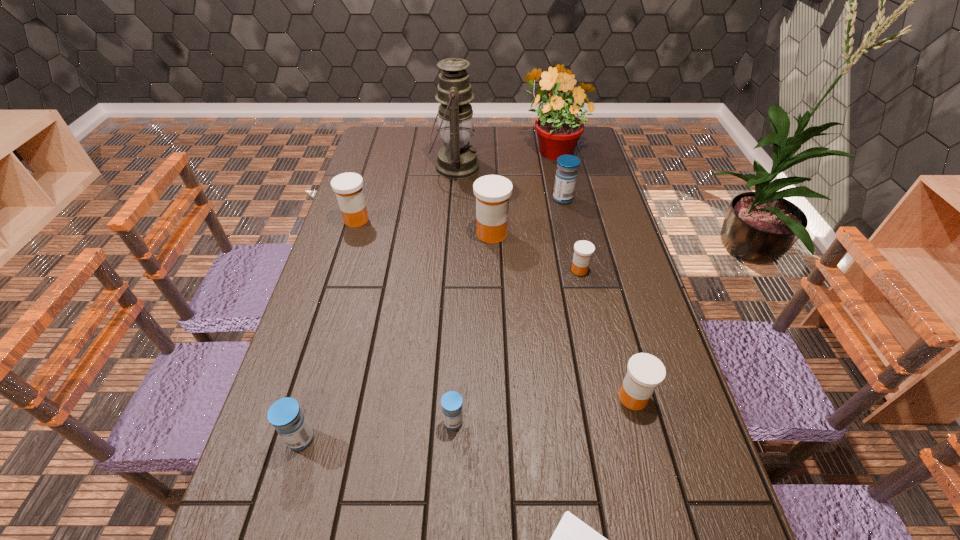
The image size is (960, 540). I want to click on the second closest object to the fifth medicine from right to left, so click(285, 415).

Locate an element on the screen. The width and height of the screenshot is (960, 540). object that is the seventh closest to the shortest object is located at coordinates (566, 175).

Where is `medicine that is the closest one to the oil lamp`? This screenshot has width=960, height=540. medicine that is the closest one to the oil lamp is located at coordinates (492, 192).

Identify the location of the fourth closest medicine to the eighth nearest object. The width and height of the screenshot is (960, 540). (645, 372).

Identify the location of orange medicine that stands as the fourth closest to the second smallest blue medicine. (583, 250).

Image resolution: width=960 pixels, height=540 pixels. In order to click on orange medicine that stands as the closest to the nearest orange medicine in this screenshot , I will do `click(583, 250)`.

At what (x,y) coordinates should I click in order to perform the action: click on the second closest blue medicine relative to the farthest blue medicine. Please return your answer as a coordinate pair (x, y). Looking at the image, I should click on (285, 415).

Locate which blue medicine ranks second in proximity to the biggest blue medicine. Please provide its 2D coordinates. Your answer should be formatted as a tuple, i.e. [(x, y)], where the tuple contains the x and y coordinates of a point satisfying the conditions above.

[(285, 415)]

Locate an element on the screen. This screenshot has width=960, height=540. free space that satisfies the following two spatial constraints: 1. on the back side of the rightmost blue medicine; 2. on the left side of the red flowerpot is located at coordinates (552, 148).

The height and width of the screenshot is (540, 960). What are the coordinates of `vacant area in the image that satisfies the following two spatial constraints: 1. on the back side of the third medicine from left to right; 2. on the right side of the red flowerpot` in the screenshot? It's located at (466, 148).